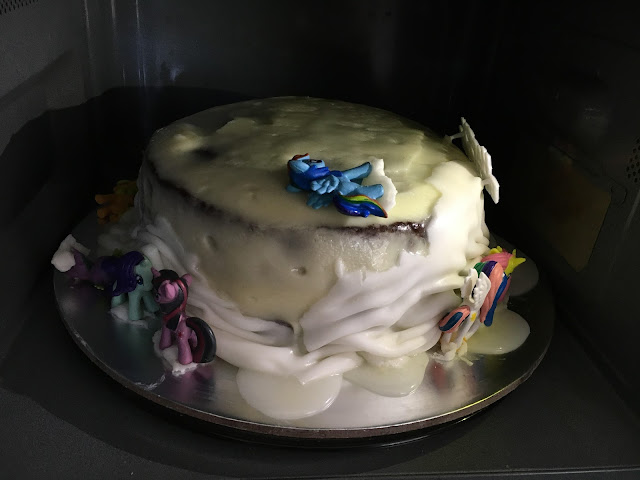
Find the location of a particular element. toy horse is located at coordinates (329, 187), (474, 303), (132, 293), (97, 273), (116, 202).